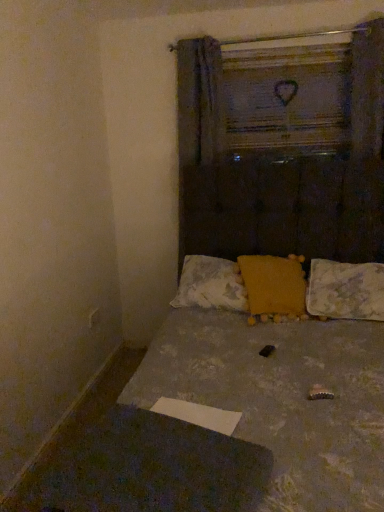
How much space does fluffy white pillow at lower right, marked as the first pillow in a right-to-left arrangement, occupy horizontally?

16.88 inches.

In order to face wooden frame at upper center, should I rotate leftwards or rightwards?

A 12.440 degree turn to the right will do.

What do you see at coordinates (280, 380) in the screenshot? I see `fluffy fabric bed at center` at bounding box center [280, 380].

Identify the location of yellow fabric pillow at center, which is counted as the 1th pillow, starting from the left. [x=211, y=284].

In the image, is yellow fuzzy pillow at center, which ranks as the second pillow in right-to-left order, on the left side or the right side of fluffy fabric bed at center?

Clearly, yellow fuzzy pillow at center, which ranks as the second pillow in right-to-left order, is on the right of fluffy fabric bed at center in the image.

From the image's perspective, between yellow fuzzy pillow at center, which ranks as the second pillow in right-to-left order, and fluffy fabric bed at center, who is located below?

fluffy fabric bed at center, from the image's perspective.

Considering the positions of objects yellow fuzzy pillow at center, which ranks as the second pillow in right-to-left order, and fluffy fabric bed at center in the image provided, who is behind, yellow fuzzy pillow at center, which ranks as the second pillow in right-to-left order, or fluffy fabric bed at center?

yellow fuzzy pillow at center, which ranks as the second pillow in right-to-left order, is further away from the camera.

Which of these two, wooden frame at upper center or fluffy white pillow at lower right, placed as the third pillow when sorted from left to right, stands taller?

wooden frame at upper center is taller.

Is point (315, 61) less distant than point (357, 311)?

No, it is behind (357, 311).

You are a GUI agent. You are given a task and a screenshot of the screen. Output one action in this format:
    pyautogui.click(x=<x>, y=<y>)
    Task: Click on the pillow on the right of wooden frame at upper center
    Image resolution: width=384 pixels, height=512 pixels.
    Given the screenshot: What is the action you would take?
    pyautogui.click(x=345, y=290)

From the picture: Who is bigger, wooden frame at upper center or fluffy white pillow at lower right, placed as the third pillow when sorted from left to right?

fluffy white pillow at lower right, placed as the third pillow when sorted from left to right, is bigger.

From their relative heights in the image, would you say fluffy white pillow at lower right, placed as the third pillow when sorted from left to right, is taller or shorter than fluffy fabric bed at center?

fluffy white pillow at lower right, placed as the third pillow when sorted from left to right, is shorter than fluffy fabric bed at center.

Which object is more forward, fluffy white pillow at lower right, placed as the third pillow when sorted from left to right, or fluffy fabric bed at center?

Positioned in front is fluffy fabric bed at center.

From the image's perspective, is fluffy white pillow at lower right, marked as the first pillow in a right-to-left arrangement, located above fluffy fabric bed at center?

Yes, from the image's perspective, fluffy white pillow at lower right, marked as the first pillow in a right-to-left arrangement, is over fluffy fabric bed at center.

Does wooden frame at upper center have a lesser width compared to fluffy fabric bed at center?

Yes, wooden frame at upper center is thinner than fluffy fabric bed at center.

Considering the positions of point (277, 63) and point (203, 315), is point (277, 63) closer or farther from the camera than point (203, 315)?

Point (277, 63) appears to be farther away from the viewer than point (203, 315).

Does wooden frame at upper center have a larger size compared to fluffy fabric bed at center?

No, wooden frame at upper center is not bigger than fluffy fabric bed at center.

Which of these two, fluffy fabric bed at center or yellow fuzzy pillow at center, which ranks as the second pillow in right-to-left order, stands shorter?

yellow fuzzy pillow at center, which ranks as the second pillow in right-to-left order, is shorter.

Does fluffy fabric bed at center turn towards yellow fuzzy pillow at center, which ranks as the 2th pillow in left-to-right order?

No, fluffy fabric bed at center does not turn towards yellow fuzzy pillow at center, which ranks as the 2th pillow in left-to-right order.

Is fluffy fabric bed at center not close to yellow fuzzy pillow at center, which ranks as the 2th pillow in left-to-right order?

That's not correct — fluffy fabric bed at center is a little close to yellow fuzzy pillow at center, which ranks as the 2th pillow in left-to-right order.

Considering the relative positions of fluffy fabric bed at center and yellow fuzzy pillow at center, which ranks as the second pillow in right-to-left order, in the image provided, is fluffy fabric bed at center in front of yellow fuzzy pillow at center, which ranks as the second pillow in right-to-left order,?

Yes, fluffy fabric bed at center is in front of yellow fuzzy pillow at center, which ranks as the second pillow in right-to-left order.

Which is nearer, (232,108) or (220,308)?

Clearly, point (232,108) is more distant from the camera than point (220,308).

What's the angular difference between wooden frame at upper center and yellow fabric pillow at center, placed as the 3th pillow when sorted from right to left,'s facing directions?

The facing directions of wooden frame at upper center and yellow fabric pillow at center, placed as the 3th pillow when sorted from right to left, are 1.07 degrees apart.

Between wooden frame at upper center and yellow fabric pillow at center, which is counted as the 1th pillow, starting from the left, which one appears on the left side from the viewer's perspective?

yellow fabric pillow at center, which is counted as the 1th pillow, starting from the left, is more to the left.

Could you tell me if wooden frame at upper center is turned towards yellow fabric pillow at center, which is counted as the 1th pillow, starting from the left?

No, wooden frame at upper center is not facing towards yellow fabric pillow at center, which is counted as the 1th pillow, starting from the left.

Is yellow fabric pillow at center, which is counted as the 1th pillow, starting from the left, looking in the opposite direction of fluffy white pillow at lower right, placed as the third pillow when sorted from left to right?

yellow fabric pillow at center, which is counted as the 1th pillow, starting from the left, is not turned away from fluffy white pillow at lower right, placed as the third pillow when sorted from left to right.

From the image's perspective, which one is positioned higher, yellow fabric pillow at center, placed as the 3th pillow when sorted from right to left, or fluffy white pillow at lower right, placed as the third pillow when sorted from left to right?

yellow fabric pillow at center, placed as the 3th pillow when sorted from right to left, appears higher in the image.

Considering the sizes of objects yellow fabric pillow at center, which is counted as the 1th pillow, starting from the left, and fluffy white pillow at lower right, placed as the third pillow when sorted from left to right, in the image provided, who is bigger, yellow fabric pillow at center, which is counted as the 1th pillow, starting from the left, or fluffy white pillow at lower right, placed as the third pillow when sorted from left to right,?

yellow fabric pillow at center, which is counted as the 1th pillow, starting from the left, is bigger.

How different are the orientations of yellow fabric pillow at center, which is counted as the 1th pillow, starting from the left, and fluffy white pillow at lower right, placed as the third pillow when sorted from left to right, in degrees?

0.601 degrees.

The image size is (384, 512). In the image, there is a yellow fuzzy pillow at center, which ranks as the 2th pillow in left-to-right order. Find the location of `bed below it (from the image's perspective)`. bed below it (from the image's perspective) is located at coordinates (280, 380).

Identify the location of pillow on the right side of wooden frame at upper center. (345, 290).

Considering their positions, is wooden frame at upper center positioned closer to yellow fabric pillow at center, which is counted as the 1th pillow, starting from the left, than fluffy white pillow at lower right, placed as the third pillow when sorted from left to right?

fluffy white pillow at lower right, placed as the third pillow when sorted from left to right, lies closer to yellow fabric pillow at center, which is counted as the 1th pillow, starting from the left, than the other object.

From the image, which object appears to be farther from yellow fabric pillow at center, placed as the 3th pillow when sorted from right to left, fluffy fabric bed at center or fluffy white pillow at lower right, placed as the third pillow when sorted from left to right?

Based on the image, fluffy white pillow at lower right, placed as the third pillow when sorted from left to right, appears to be further to yellow fabric pillow at center, placed as the 3th pillow when sorted from right to left.

When comparing their distances from wooden frame at upper center, does yellow fabric pillow at center, placed as the 3th pillow when sorted from right to left, or fluffy fabric bed at center seem further?

Among the two, fluffy fabric bed at center is located further to wooden frame at upper center.

From the image, which object appears to be farther from fluffy fabric bed at center, fluffy white pillow at lower right, marked as the first pillow in a right-to-left arrangement, or yellow fabric pillow at center, which is counted as the 1th pillow, starting from the left?

fluffy white pillow at lower right, marked as the first pillow in a right-to-left arrangement, is further to fluffy fabric bed at center.

Which object lies further to the anchor point fluffy fabric bed at center, yellow fuzzy pillow at center, which ranks as the second pillow in right-to-left order, or yellow fabric pillow at center, placed as the 3th pillow when sorted from right to left?

yellow fuzzy pillow at center, which ranks as the second pillow in right-to-left order, is further to fluffy fabric bed at center.

Which object lies nearer to the anchor point fluffy white pillow at lower right, marked as the first pillow in a right-to-left arrangement, yellow fuzzy pillow at center, which ranks as the second pillow in right-to-left order, or fluffy fabric bed at center?

yellow fuzzy pillow at center, which ranks as the second pillow in right-to-left order.

Considering their positions, is fluffy fabric bed at center positioned closer to wooden frame at upper center than yellow fabric pillow at center, which is counted as the 1th pillow, starting from the left?

Among the two, yellow fabric pillow at center, which is counted as the 1th pillow, starting from the left, is located nearer to wooden frame at upper center.

Estimate the real-world distances between objects in this image. Which object is closer to yellow fabric pillow at center, which is counted as the 1th pillow, starting from the left, fluffy white pillow at lower right, marked as the first pillow in a right-to-left arrangement, or fluffy fabric bed at center?

fluffy fabric bed at center.

Find the location of `pillow between wooden frame at upper center and yellow fuzzy pillow at center, which ranks as the second pillow in right-to-left order, in the up-down direction`. pillow between wooden frame at upper center and yellow fuzzy pillow at center, which ranks as the second pillow in right-to-left order, in the up-down direction is located at coordinates (211, 284).

At what (x,y) coordinates should I click in order to perform the action: click on pillow between fluffy fabric bed at center and yellow fuzzy pillow at center, which ranks as the second pillow in right-to-left order, along the z-axis. Please return your answer as a coordinate pair (x, y). The height and width of the screenshot is (512, 384). Looking at the image, I should click on (345, 290).

At what (x,y) coordinates should I click in order to perform the action: click on pillow between yellow fabric pillow at center, which is counted as the 1th pillow, starting from the left, and fluffy white pillow at lower right, marked as the first pillow in a right-to-left arrangement, in the horizontal direction. Please return your answer as a coordinate pair (x, y). Looking at the image, I should click on (274, 284).